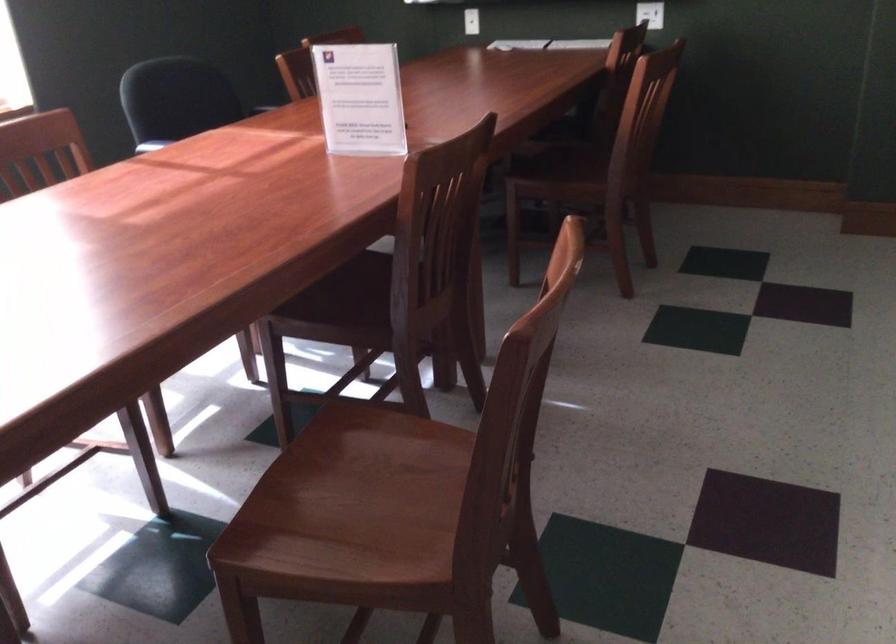
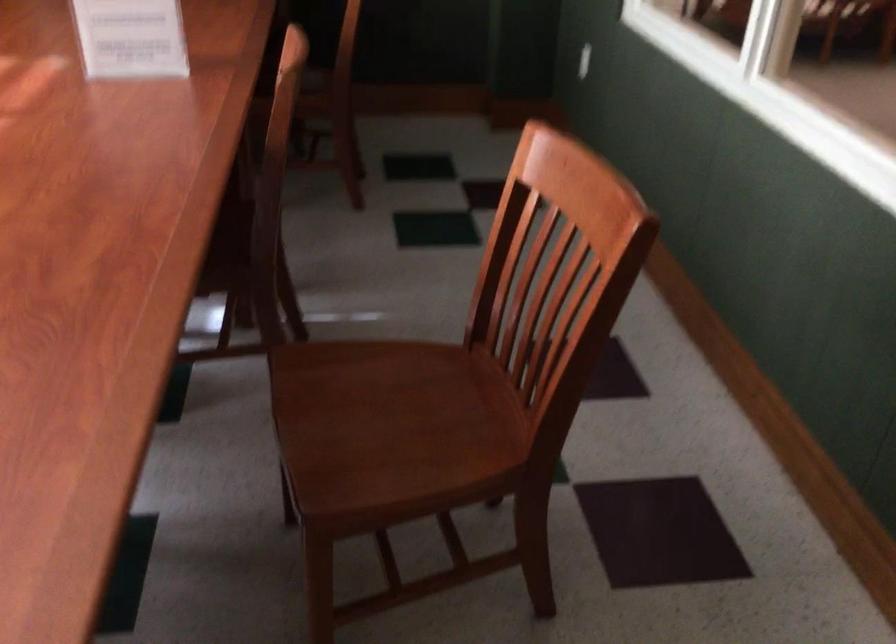
Question: The camera is either moving clockwise (left) or counter-clockwise (right) around the object. The first image is from the beginning of the video and the second image is from the end. Is the camera moving left or right when shooting the video?

Choices:
 (A) Left
 (B) Right

Answer: (A)